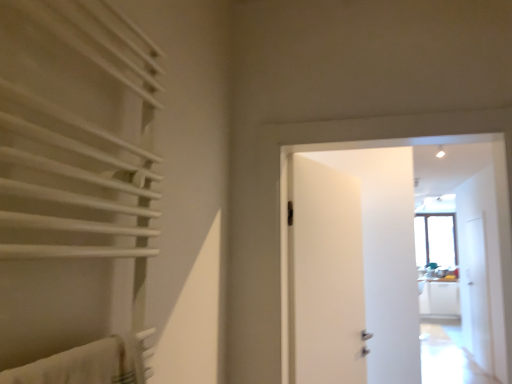
Measure the distance between point (279,269) and camera.

They are 5.47 feet apart.

You are a GUI agent. You are given a task and a screenshot of the screen. Output one action in this format:
    pyautogui.click(x=<x>, y=<y>)
    Task: Click on the transparent glass screen door at right
    This screenshot has height=384, width=512.
    Given the screenshot: What is the action you would take?
    pyautogui.click(x=479, y=293)

At what (x,y) coordinates should I click in order to perform the action: click on white matte towel rack at left. Please return your answer as a coordinate pair (x, y). Looking at the image, I should click on (75, 191).

Is white matte towel rack at left oriented towards white matte door at center?

No, white matte towel rack at left is not facing towards white matte door at center.

Which of these two, white matte towel rack at left or white matte door at center, is wider?

Wider between the two is white matte door at center.

Which object is closer to the camera, white matte towel rack at left or white matte door at center?

white matte towel rack at left is more forward.

Considering the relative positions of white matte towel rack at left and white matte door at center in the image provided, is white matte towel rack at left to the right of white matte door at center from the viewer's perspective?

No, white matte towel rack at left is not to the right of white matte door at center.

Identify the location of curtain lying above the transparent glass screen door at right (from the image's perspective). (75, 191).

Is transparent glass screen door at right oriented towards white matte towel rack at left?

No, transparent glass screen door at right is not oriented towards white matte towel rack at left.

Considering the relative positions of white matte door at center and white matte towel rack at left in the image provided, is white matte door at center to the left of white matte towel rack at left from the viewer's perspective?

No, white matte door at center is not to the left of white matte towel rack at left.

Is white matte door at center thinner than white matte towel rack at left?

In fact, white matte door at center might be wider than white matte towel rack at left.

From the image's perspective, would you say white matte door at center is positioned over white matte towel rack at left?

No, from the image's perspective, white matte door at center is not on top of white matte towel rack at left.

Is point (481, 292) behind point (269, 182)?

Yes, it is.

Based on their sizes in the image, would you say transparent glass screen door at right is bigger or smaller than white matte door at center?

Clearly, transparent glass screen door at right is smaller in size than white matte door at center.

Does white matte door at center have a lesser height compared to transparent glass screen door at right?

Yes.

Is white matte door at center not near transparent glass screen door at right?

Yes, white matte door at center and transparent glass screen door at right are quite far apart.

Consider the image. Does white matte door at center have a greater width compared to transparent glass screen door at right?

Yes, white matte door at center is wider than transparent glass screen door at right.

Can you confirm if white matte towel rack at left is shorter than transparent glass screen door at right?

Indeed, white matte towel rack at left has a lesser height compared to transparent glass screen door at right.

Is white matte towel rack at left facing away from transparent glass screen door at right?

No, white matte towel rack at left's orientation is not away from transparent glass screen door at right.

Is white matte towel rack at left inside the boundaries of transparent glass screen door at right, or outside?

white matte towel rack at left lies outside transparent glass screen door at right.

Does point (83, 54) lie in front of point (477, 264)?

Yes, it is in front of point (477, 264).

I want to click on door on the right of white matte towel rack at left, so click(287, 200).

The height and width of the screenshot is (384, 512). I want to click on screen door below the white matte towel rack at left (from the image's perspective), so click(x=479, y=293).

From the picture: Considering their positions, is white matte door at center positioned further to white matte towel rack at left than transparent glass screen door at right?

transparent glass screen door at right is positioned further to the anchor white matte towel rack at left.

Consider the image. When comparing their distances from transparent glass screen door at right, does white matte door at center or white matte towel rack at left seem closer?

white matte door at center.

From the image, which object appears to be farther from white matte door at center, white matte towel rack at left or transparent glass screen door at right?

transparent glass screen door at right is further to white matte door at center.

Based on their spatial positions, is transparent glass screen door at right or white matte towel rack at left further from white matte door at center?

transparent glass screen door at right.

From the image, which object appears to be nearer to transparent glass screen door at right, white matte towel rack at left or white matte door at center?

Among the two, white matte door at center is located nearer to transparent glass screen door at right.

From the picture: From the image, which object appears to be nearer to white matte towel rack at left, transparent glass screen door at right or white matte door at center?

Based on the image, white matte door at center appears to be nearer to white matte towel rack at left.

Identify the location of door between white matte towel rack at left and transparent glass screen door at right along the z-axis. This screenshot has height=384, width=512. (287, 200).